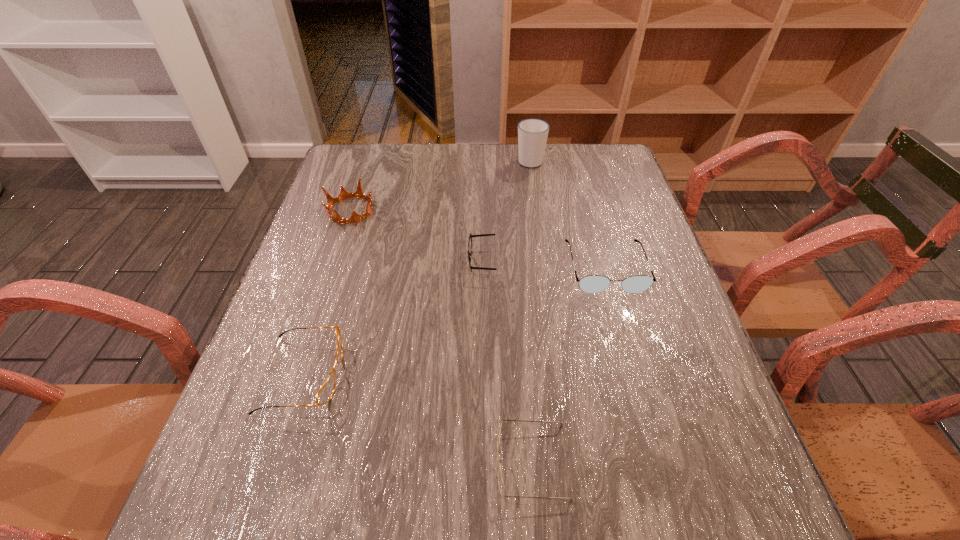
Where is `vacant space located 0.350m on the front-facing side of the nearest spectacles`? vacant space located 0.350m on the front-facing side of the nearest spectacles is located at coordinates (286, 462).

Identify the location of vacant space situated 0.370m on the front-facing side of the nearest spectacles. (274, 462).

Image resolution: width=960 pixels, height=540 pixels. I want to click on blank space located on the front-facing side of the nearest spectacles, so click(x=430, y=462).

Find the location of a particular element. This screenshot has width=960, height=540. object present at the far edge is located at coordinates (532, 133).

In order to click on object that is at the near edge in this screenshot , I will do `click(500, 480)`.

Find the location of a particular element. crown that is at the left edge is located at coordinates (359, 193).

You are a GUI agent. You are given a task and a screenshot of the screen. Output one action in this format:
    pyautogui.click(x=<x>, y=<y>)
    Task: Click on the spectacles positioned at the left edge
    The height and width of the screenshot is (540, 960).
    Given the screenshot: What is the action you would take?
    pyautogui.click(x=325, y=393)

You are a GUI agent. You are given a task and a screenshot of the screen. Output one action in this format:
    pyautogui.click(x=<x>, y=<y>)
    Task: Click on the object that is positioned at the right edge
    This screenshot has height=540, width=960.
    Given the screenshot: What is the action you would take?
    pyautogui.click(x=592, y=284)

Find the location of a particular element. The height and width of the screenshot is (540, 960). vacant area at the far edge of the desktop is located at coordinates (421, 167).

In the image, there is a desktop. In order to click on vacant space at the left edge in this screenshot , I will do `click(316, 260)`.